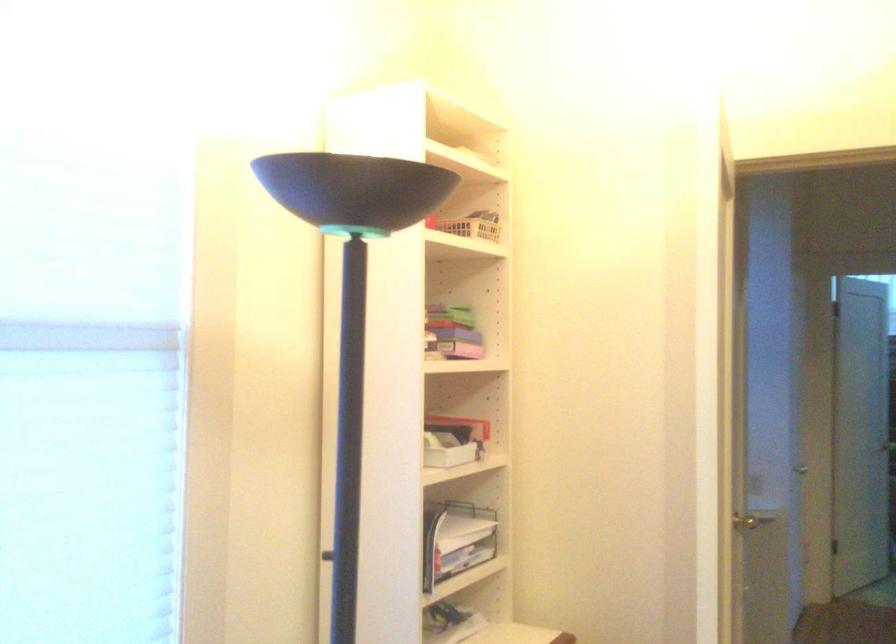
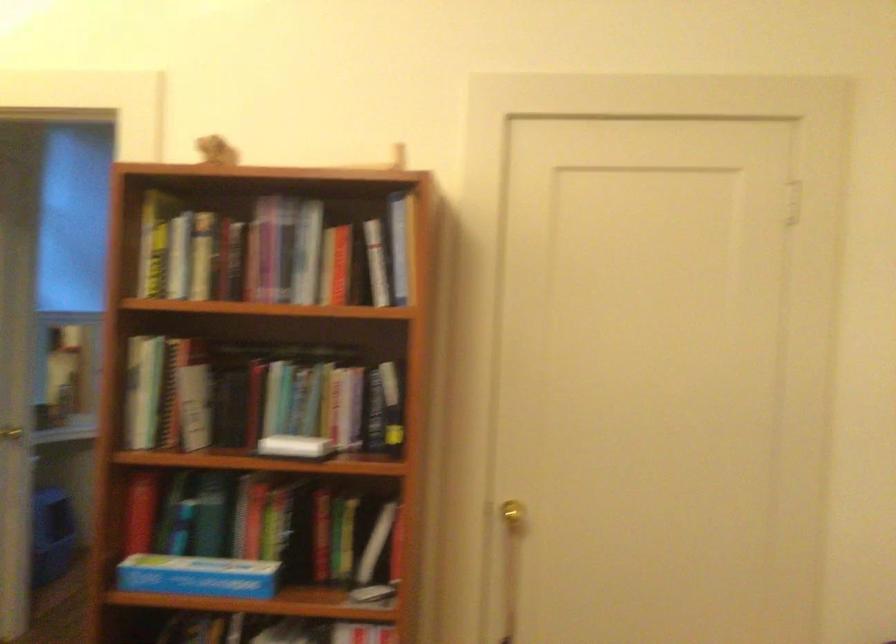
In a continuous first-person perspective shot, in which direction is the camera moving?

The movement direction of the cameraman is right, backward.